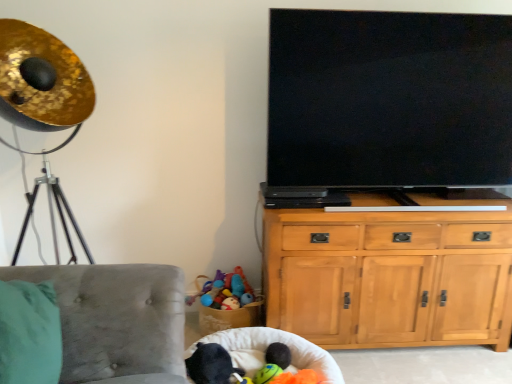
Question: Is black plush toy at lower center further to camera compared to velvet grey chair at lower left?

Choices:
 (A) yes
 (B) no

Answer: (A)

Question: Considering the relative sizes of black plush toy at lower center and velvet grey chair at lower left in the image provided, is black plush toy at lower center smaller than velvet grey chair at lower left?

Choices:
 (A) yes
 (B) no

Answer: (A)

Question: Does black plush toy at lower center lie in front of velvet grey chair at lower left?

Choices:
 (A) no
 (B) yes

Answer: (A)

Question: Would you say black plush toy at lower center is outside velvet grey chair at lower left?

Choices:
 (A) yes
 (B) no

Answer: (A)

Question: From a real-world perspective, does black plush toy at lower center stand above velvet grey chair at lower left?

Choices:
 (A) no
 (B) yes

Answer: (A)

Question: Is black plush toy at lower center at the right side of velvet grey chair at lower left?

Choices:
 (A) yes
 (B) no

Answer: (A)

Question: Can you confirm if light wood cabinet at center right is positioned to the right of white fabric bean bag at lower center?

Choices:
 (A) yes
 (B) no

Answer: (A)

Question: Is light wood cabinet at center right at the left side of white fabric bean bag at lower center?

Choices:
 (A) yes
 (B) no

Answer: (B)

Question: Is light wood cabinet at center right wider than white fabric bean bag at lower center?

Choices:
 (A) no
 (B) yes

Answer: (A)

Question: Can you confirm if light wood cabinet at center right is smaller than white fabric bean bag at lower center?

Choices:
 (A) yes
 (B) no

Answer: (B)

Question: Does light wood cabinet at center right have a larger size compared to white fabric bean bag at lower center?

Choices:
 (A) yes
 (B) no

Answer: (A)

Question: Does light wood cabinet at center right have a greater height compared to white fabric bean bag at lower center?

Choices:
 (A) yes
 (B) no

Answer: (A)

Question: Does black plush toy at lower center appear on the left side of flat screen tv at upper right?

Choices:
 (A) no
 (B) yes

Answer: (B)